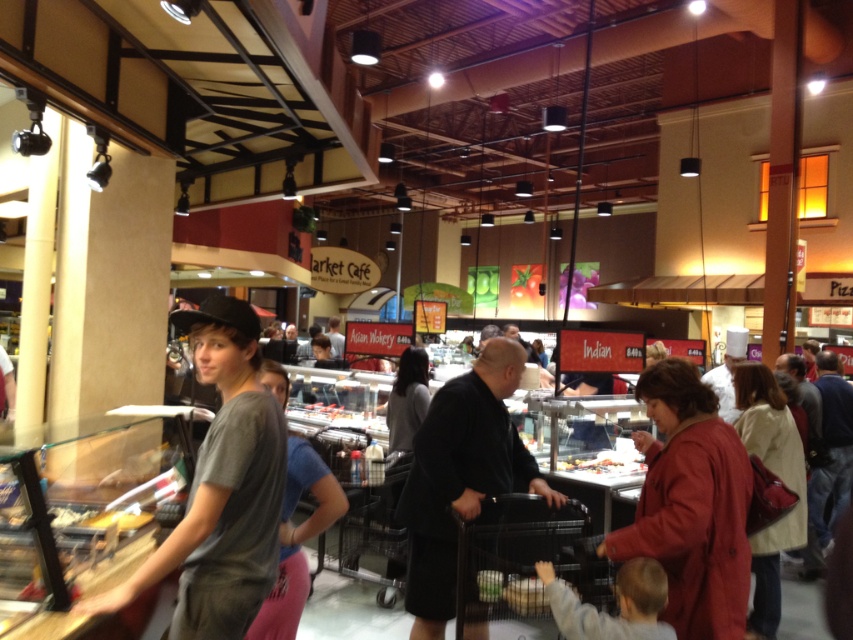
Question: Is gray cotton t-shirt at center above matte red coat at lower right?

Choices:
 (A) yes
 (B) no

Answer: (A)

Question: Can you confirm if gray cotton t-shirt at center is positioned to the left of gray cotton shirt at center?

Choices:
 (A) yes
 (B) no

Answer: (A)

Question: Which of the following is the closest to the observer?

Choices:
 (A) matte red coat at lower right
 (B) light beige sweater at lower right

Answer: (A)

Question: Can you confirm if gray cotton t-shirt at center is positioned above gray cotton shirt at center?

Choices:
 (A) yes
 (B) no

Answer: (A)

Question: Among these points, which one is farthest from the camera?

Choices:
 (A) (743, 568)
 (B) (318, 512)

Answer: (B)

Question: Which object appears closest to the camera in this image?

Choices:
 (A) gray cotton shirt at center
 (B) gray cotton t-shirt at center

Answer: (B)